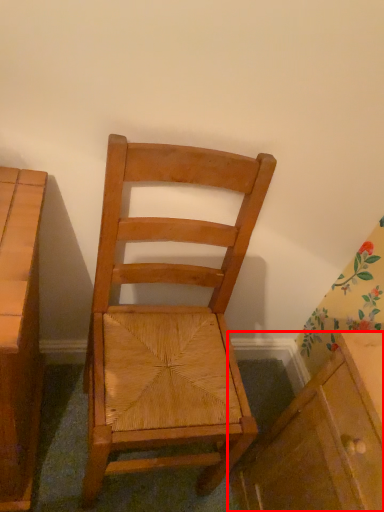
Question: From the image's perspective, considering the relative positions of cabinetry (annotated by the red box) and chair in the image provided, where is cabinetry (annotated by the red box) located with respect to the staircase?

Choices:
 (A) above
 (B) below

Answer: (B)